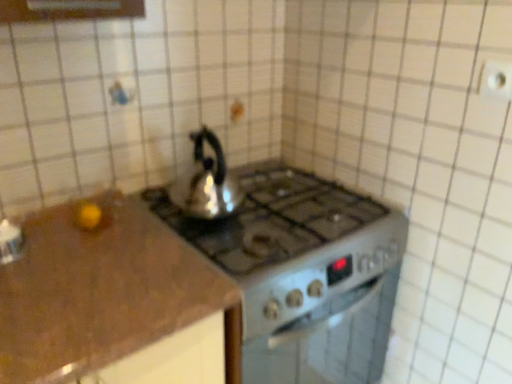
Image resolution: width=512 pixels, height=384 pixels. Identify the location of white plastic electric outlet at upper right. (496, 81).

Locate an element on the screen. The height and width of the screenshot is (384, 512). white plastic electric outlet at upper right is located at coordinates pyautogui.click(x=496, y=81).

From the image's perspective, between satin silver gas stove at center and shiny metallic kettle at center, which one is located above?

shiny metallic kettle at center appears higher in the image.

Consider the image. Considering the relative sizes of satin silver gas stove at center and shiny metallic kettle at center in the image provided, is satin silver gas stove at center wider than shiny metallic kettle at center?

Yes.

From a real-world perspective, which object stands above the other?

shiny metallic kettle at center, from a real-world perspective.

Between satin silver gas stove at center and shiny metallic kettle at center, which one has more height?

satin silver gas stove at center is taller.

Looking at this image, how many degrees apart are the facing directions of white plastic electric outlet at upper right and satin silver gas stove at center?

90.7 degrees.

Considering the sizes of objects white plastic electric outlet at upper right and satin silver gas stove at center in the image provided, who is taller, white plastic electric outlet at upper right or satin silver gas stove at center?

Standing taller between the two is satin silver gas stove at center.

Considering the points (495, 73) and (312, 179), which point is behind, point (495, 73) or point (312, 179)?

The point (312, 179) is more distant.

Looking at this image, considering the sizes of objects white plastic electric outlet at upper right and satin silver gas stove at center in the image provided, who is wider, white plastic electric outlet at upper right or satin silver gas stove at center?

satin silver gas stove at center.

Locate an element on the screen. Image resolution: width=512 pixels, height=384 pixels. electric outlet on the right of the shiny metallic kettle at center is located at coordinates tap(496, 81).

Based on the photo, is shiny metallic kettle at center not inside white plastic electric outlet at upper right?

Absolutely, shiny metallic kettle at center is external to white plastic electric outlet at upper right.

Considering their positions, is shiny metallic kettle at center located in front of or behind white plastic electric outlet at upper right?

Clearly, shiny metallic kettle at center is behind white plastic electric outlet at upper right.

Which is more to the right, white plastic electric outlet at upper right or shiny metallic kettle at center?

white plastic electric outlet at upper right is more to the right.

Does white plastic electric outlet at upper right have a lesser height compared to shiny metallic kettle at center?

Correct, white plastic electric outlet at upper right is not as tall as shiny metallic kettle at center.

How distant is white plastic electric outlet at upper right from shiny metallic kettle at center?

white plastic electric outlet at upper right and shiny metallic kettle at center are 28.95 inches apart.

Is white plastic electric outlet at upper right positioned with its back to shiny metallic kettle at center?

No, shiny metallic kettle at center is not at the back of white plastic electric outlet at upper right.

From a real-world perspective, is shiny metallic kettle at center under satin silver gas stove at center?

No, from a real-world perspective, shiny metallic kettle at center is not beneath satin silver gas stove at center.

Can you confirm if shiny metallic kettle at center is wider than satin silver gas stove at center?

No, shiny metallic kettle at center is not wider than satin silver gas stove at center.

Is shiny metallic kettle at center smaller than satin silver gas stove at center?

Indeed, shiny metallic kettle at center has a smaller size compared to satin silver gas stove at center.

Is satin silver gas stove at center looking in the opposite direction of white plastic electric outlet at upper right?

No, satin silver gas stove at center's orientation is not away from white plastic electric outlet at upper right.

Who is taller, satin silver gas stove at center or white plastic electric outlet at upper right?

Standing taller between the two is satin silver gas stove at center.

Is satin silver gas stove at center spatially inside white plastic electric outlet at upper right, or outside of it?

satin silver gas stove at center is spatially situated outside white plastic electric outlet at upper right.

Identify the location of kettle above the satin silver gas stove at center (from a real-world perspective). (207, 182).

This screenshot has width=512, height=384. I want to click on gas stove lying on the left of white plastic electric outlet at upper right, so click(x=303, y=272).

When comparing their distances from satin silver gas stove at center, does shiny metallic kettle at center or white plastic electric outlet at upper right seem closer?

shiny metallic kettle at center is positioned closer to the anchor satin silver gas stove at center.

Estimate the real-world distances between objects in this image. Which object is further from shiny metallic kettle at center, white plastic electric outlet at upper right or satin silver gas stove at center?

white plastic electric outlet at upper right lies further to shiny metallic kettle at center than the other object.

Estimate the real-world distances between objects in this image. Which object is closer to white plastic electric outlet at upper right, satin silver gas stove at center or shiny metallic kettle at center?

satin silver gas stove at center is closer to white plastic electric outlet at upper right.

Based on their spatial positions, is shiny metallic kettle at center or satin silver gas stove at center further from white plastic electric outlet at upper right?

shiny metallic kettle at center is further to white plastic electric outlet at upper right.

Looking at the image, which one is located closer to satin silver gas stove at center, white plastic electric outlet at upper right or shiny metallic kettle at center?

The object closer to satin silver gas stove at center is shiny metallic kettle at center.

Looking at the image, which one is located closer to shiny metallic kettle at center, satin silver gas stove at center or white plastic electric outlet at upper right?

satin silver gas stove at center is positioned closer to the anchor shiny metallic kettle at center.

Where is `kettle between white plastic electric outlet at upper right and satin silver gas stove at center in the up-down direction`? kettle between white plastic electric outlet at upper right and satin silver gas stove at center in the up-down direction is located at coordinates (207, 182).